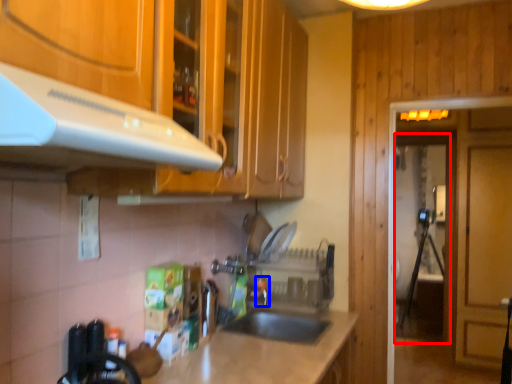
Question: Among these objects, which one is farthest to the camera, glass door (highlighted by a red box) or faucet (highlighted by a blue box)?

Choices:
 (A) glass door
 (B) faucet

Answer: (A)